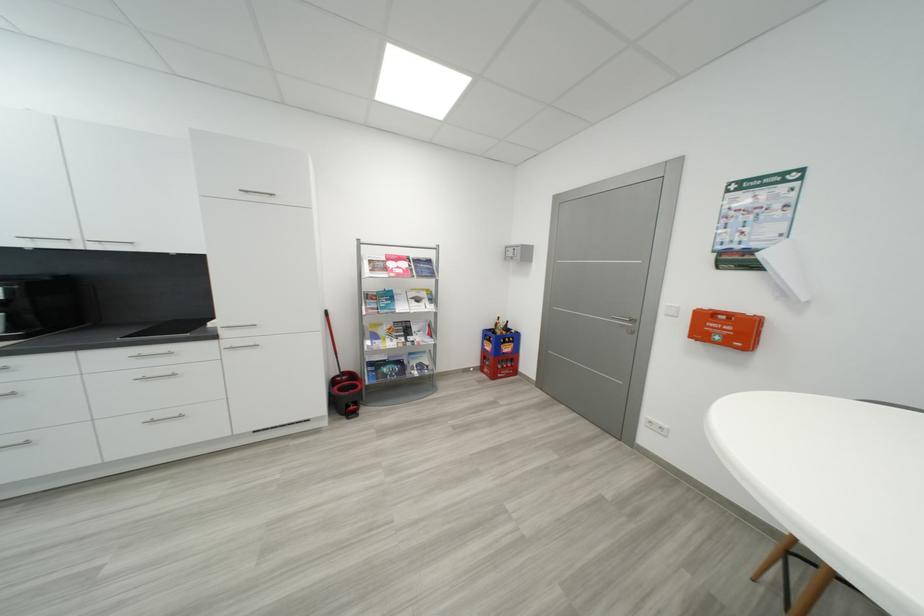
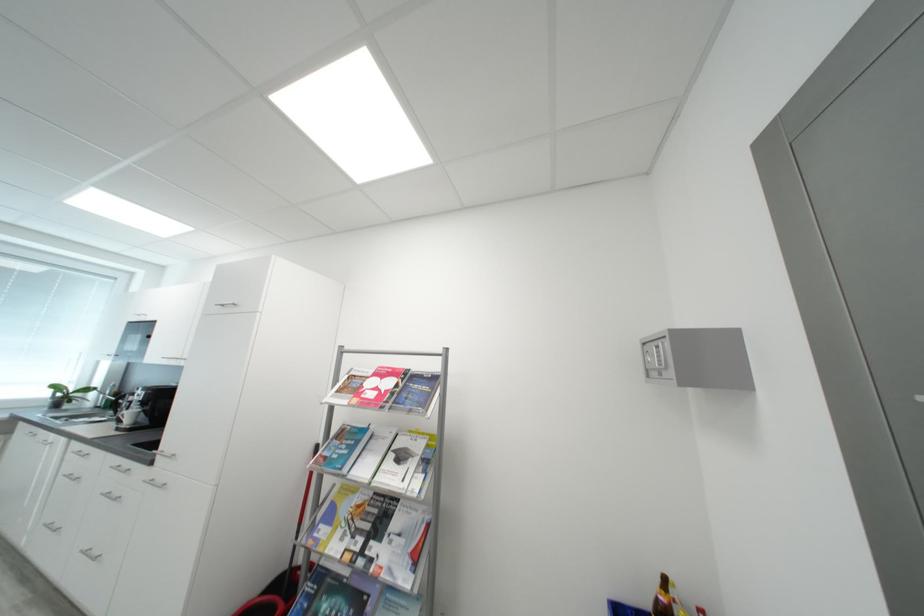
Locate, in the second image, the point that corresponds to point (517, 254) in the first image.

(660, 361)